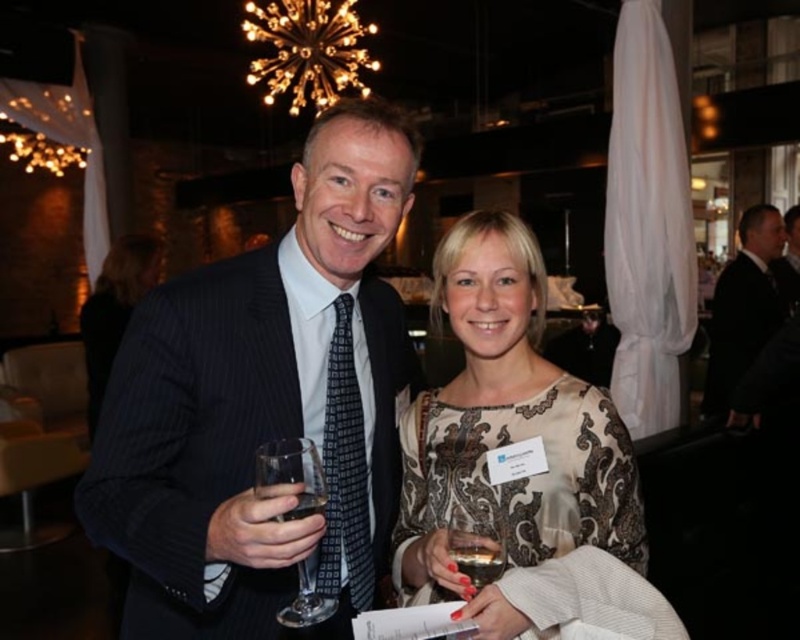
Question: Which object is closer to the camera taking this photo?

Choices:
 (A) silky beige dress at center
 (B) translucent glass at lower center
 (C) clear glass wine glass at center
 (D) clear glass at center

Answer: (D)

Question: Does matte black suit at center appear over silky beige dress at center?

Choices:
 (A) no
 (B) yes

Answer: (B)

Question: Does matte black suit at center have a larger size compared to silky beige dress at center?

Choices:
 (A) no
 (B) yes

Answer: (B)

Question: Can you confirm if translucent glass at lower center is smaller than clear glass at center?

Choices:
 (A) no
 (B) yes

Answer: (A)

Question: Which object appears closest to the camera in this image?

Choices:
 (A) clear glass wine glass at center
 (B) matte black suit at center

Answer: (B)

Question: Estimate the real-world distances between objects in this image. Which object is closer to the translucent glass at lower center?

Choices:
 (A) matte black suit at center
 (B) black suit at right

Answer: (A)